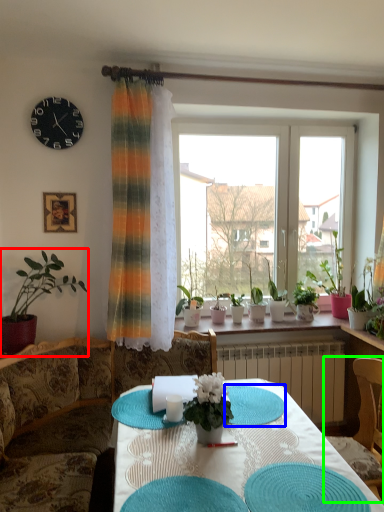
Question: Considering the real-world distances, which object is farthest from houseplant (highlighted by a red box)? mat (highlighted by a blue box) or chair (highlighted by a green box)?

Choices:
 (A) mat
 (B) chair

Answer: (B)